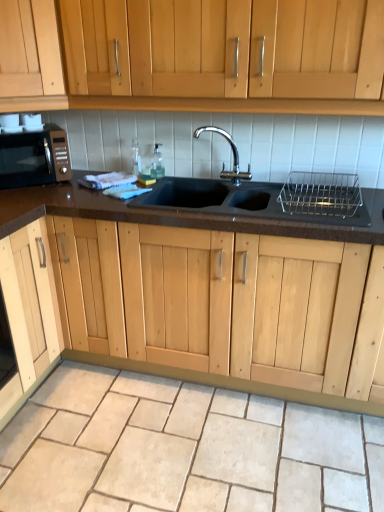
Question: Does metallic silver dish rack at upper right have a greater height compared to beige stone granite at lower center?

Choices:
 (A) yes
 (B) no

Answer: (A)

Question: From the image's perspective, is metallic silver dish rack at upper right below beige stone granite at lower center?

Choices:
 (A) yes
 (B) no

Answer: (B)

Question: Considering the relative sizes of metallic silver dish rack at upper right and beige stone granite at lower center in the image provided, is metallic silver dish rack at upper right shorter than beige stone granite at lower center?

Choices:
 (A) no
 (B) yes

Answer: (A)

Question: From the image's perspective, is metallic silver dish rack at upper right on top of beige stone granite at lower center?

Choices:
 (A) yes
 (B) no

Answer: (A)

Question: Is metallic silver dish rack at upper right at the left side of beige stone granite at lower center?

Choices:
 (A) yes
 (B) no

Answer: (B)

Question: From a real-world perspective, relative to matte black microwave at left, is beige stone granite at lower center vertically above or below?

Choices:
 (A) below
 (B) above

Answer: (A)

Question: Choose the correct answer: Is beige stone granite at lower center inside matte black microwave at left or outside it?

Choices:
 (A) outside
 (B) inside

Answer: (A)

Question: In terms of size, does beige stone granite at lower center appear bigger or smaller than matte black microwave at left?

Choices:
 (A) small
 (B) big

Answer: (B)

Question: From their relative heights in the image, would you say beige stone granite at lower center is taller or shorter than matte black microwave at left?

Choices:
 (A) short
 (B) tall

Answer: (A)

Question: From the image's perspective, relative to metallic silver dish rack at upper right, is clear glass bottle at sink, which is the 1th bottle from left to right, above or below?

Choices:
 (A) above
 (B) below

Answer: (A)

Question: Relative to metallic silver dish rack at upper right, is clear glass bottle at sink, which is the second bottle in right-to-left order, in front or behind?

Choices:
 (A) front
 (B) behind

Answer: (B)

Question: Is clear glass bottle at sink, which is the second bottle in right-to-left order, wider or thinner than metallic silver dish rack at upper right?

Choices:
 (A) wide
 (B) thin

Answer: (B)

Question: In terms of size, does clear glass bottle at sink, which is the second bottle in right-to-left order, appear bigger or smaller than metallic silver dish rack at upper right?

Choices:
 (A) small
 (B) big

Answer: (A)

Question: Is metallic silver dish rack at upper right wider or thinner than black granite sink at center?

Choices:
 (A) wide
 (B) thin

Answer: (B)

Question: From a real-world perspective, relative to black granite sink at center, is metallic silver dish rack at upper right vertically above or below?

Choices:
 (A) below
 (B) above

Answer: (B)